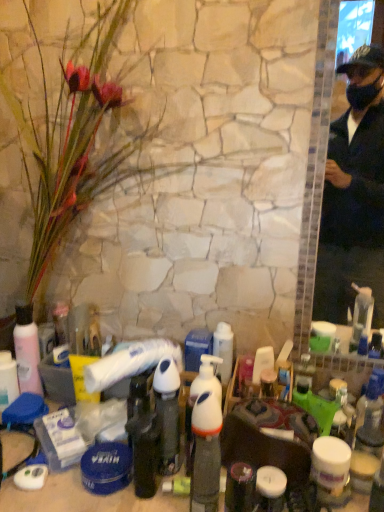
Question: Is silky pink petals at left not within white pump bottle at center?

Choices:
 (A) no
 (B) yes

Answer: (B)

Question: Is silky pink petals at left facing away from white pump bottle at center?

Choices:
 (A) no
 (B) yes

Answer: (A)

Question: Considering the relative sizes of silky pink petals at left and white pump bottle at center in the image provided, is silky pink petals at left thinner than white pump bottle at center?

Choices:
 (A) no
 (B) yes

Answer: (A)

Question: Does silky pink petals at left lie behind white pump bottle at center?

Choices:
 (A) yes
 (B) no

Answer: (B)

Question: From the image's perspective, is silky pink petals at left beneath white pump bottle at center?

Choices:
 (A) no
 (B) yes

Answer: (A)

Question: In terms of width, does white plastic pump bottle at center, arranged as the 2th bottle when viewed from the right, look wider or thinner when compared to white glossy pump bottle at center, the fourth bottle in the left-to-right sequence?

Choices:
 (A) thin
 (B) wide

Answer: (B)

Question: From the image's perspective, is white plastic pump bottle at center, which ranks as the second bottle in front-to-back order, above or below white glossy pump bottle at center, the fourth bottle in the left-to-right sequence?

Choices:
 (A) below
 (B) above

Answer: (B)

Question: Based on their sizes in the image, would you say white plastic pump bottle at center, the third bottle positioned from the back, is bigger or smaller than white glossy pump bottle at center, the first bottle from the front?

Choices:
 (A) big
 (B) small

Answer: (A)

Question: Considering the positions of point (178, 465) and point (218, 402), is point (178, 465) closer or farther from the camera than point (218, 402)?

Choices:
 (A) closer
 (B) farther

Answer: (B)

Question: From the image's perspective, is white glossy pump bottle at center, the first bottle from the front, positioned above or below silky pink petals at left?

Choices:
 (A) above
 (B) below

Answer: (B)

Question: Do you think white glossy pump bottle at center, which is the fourth bottle in back-to-front order, is within silky pink petals at left, or outside of it?

Choices:
 (A) outside
 (B) inside

Answer: (A)

Question: In terms of size, does white glossy pump bottle at center, which is the fourth bottle in back-to-front order, appear bigger or smaller than silky pink petals at left?

Choices:
 (A) small
 (B) big

Answer: (A)

Question: In the image, is white glossy pump bottle at center, the first bottle from the front, positioned in front of or behind silky pink petals at left?

Choices:
 (A) behind
 (B) front

Answer: (A)

Question: From the image's perspective, is white glossy pump bottle at center, which is the fourth bottle in back-to-front order, above or below pink matte lotion at lower left, placed as the 1th bottle when sorted from left to right?

Choices:
 (A) above
 (B) below

Answer: (B)

Question: Relative to pink matte lotion at lower left, acting as the 4th bottle starting from the front, is white glossy pump bottle at center, the first bottle from the front, in front or behind?

Choices:
 (A) front
 (B) behind

Answer: (A)